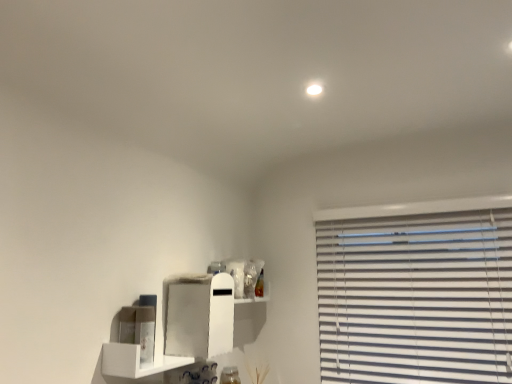
Image resolution: width=512 pixels, height=384 pixels. What do you see at coordinates (135, 361) in the screenshot? I see `white matte shelf at lower left` at bounding box center [135, 361].

Where is `white matte shelf at lower left`? white matte shelf at lower left is located at coordinates (135, 361).

The width and height of the screenshot is (512, 384). I want to click on white matte cabinet at center, so click(x=198, y=315).

What do you see at coordinates (198, 315) in the screenshot?
I see `white matte cabinet at center` at bounding box center [198, 315].

In order to face white matte cabinet at center, should I rotate leftwards or rightwards?

A 7.161 degree turn to the left will do.

At what (x,y) coordinates should I click in order to perform the action: click on white matte shelf at lower left. Please return your answer as a coordinate pair (x, y). The width and height of the screenshot is (512, 384). Looking at the image, I should click on (135, 361).

Based on their positions, is white matte cabinet at center located to the left or right of white matte shelf at lower left?

white matte cabinet at center is to the right of white matte shelf at lower left.

Between white matte cabinet at center and white matte shelf at lower left, which one is positioned in front?

white matte shelf at lower left is closer to the camera.

Considering the points (222, 334) and (133, 365), which point is behind, point (222, 334) or point (133, 365)?

The point (222, 334) is farther from the camera.

From the image's perspective, is white matte cabinet at center on white matte shelf at lower left?

Yes.

From a real-world perspective, is white matte cabinet at center beneath white matte shelf at lower left?

No, from a real-world perspective, white matte cabinet at center is not under white matte shelf at lower left.

Based on the photo, does white matte cabinet at center have a lesser width compared to white matte shelf at lower left?

No, white matte cabinet at center is not thinner than white matte shelf at lower left.

Consider the image. Does white matte cabinet at center have a lesser height compared to white matte shelf at lower left?

No, white matte cabinet at center is not shorter than white matte shelf at lower left.

Does white matte cabinet at center have a smaller size compared to white matte shelf at lower left?

No, white matte cabinet at center is not smaller than white matte shelf at lower left.

Can we say white matte cabinet at center lies outside white matte shelf at lower left?

That's correct, white matte cabinet at center is outside of white matte shelf at lower left.

Are white matte cabinet at center and white matte shelf at lower left beside each other?

white matte cabinet at center and white matte shelf at lower left are clearly separated.

Does white matte cabinet at center turn towards white matte shelf at lower left?

No, white matte cabinet at center does not turn towards white matte shelf at lower left.

What's the angular difference between white matte cabinet at center and white matte shelf at lower left's facing directions?

They differ by 90.3 degrees in their facing directions.

Locate an element on the screen. The width and height of the screenshot is (512, 384). shelf on the left of the white matte cabinet at center is located at coordinates (135, 361).

Which object is positioned more to the left, white matte shelf at lower left or white matte cabinet at center?

white matte shelf at lower left.

Is white matte shelf at lower left in front of white matte cabinet at center?

Yes, the depth of white matte shelf at lower left is less than that of white matte cabinet at center.

Is point (184, 365) more distant than point (186, 313)?

No.

From the image's perspective, is white matte shelf at lower left located above or below white matte cabinet at center?

From the image's perspective, white matte shelf at lower left appears below white matte cabinet at center.

From a real-world perspective, relative to white matte cabinet at center, is white matte shelf at lower left vertically above or below?

In terms of real-world spatial position, white matte shelf at lower left is below white matte cabinet at center.

Considering the sizes of white matte shelf at lower left and white matte cabinet at center in the image, is white matte shelf at lower left wider or thinner than white matte cabinet at center?

Considering their sizes, white matte shelf at lower left looks slimmer than white matte cabinet at center.

Considering the relative sizes of white matte shelf at lower left and white matte cabinet at center in the image provided, is white matte shelf at lower left shorter than white matte cabinet at center?

Correct, white matte shelf at lower left is not as tall as white matte cabinet at center.

Is white matte shelf at lower left bigger than white matte cabinet at center?

Incorrect, white matte shelf at lower left is not larger than white matte cabinet at center.

Can white matte cabinet at center be found inside white matte shelf at lower left?

No, white matte shelf at lower left does not contain white matte cabinet at center.

Does white matte shelf at lower left touch white matte cabinet at center?

A: No, white matte shelf at lower left is not making contact with white matte cabinet at center.

Is white matte shelf at lower left looking in the opposite direction of white matte cabinet at center?

white matte shelf at lower left is not turned away from white matte cabinet at center.

What's the angular difference between white matte shelf at lower left and white matte cabinet at center's facing directions?

The angular difference between white matte shelf at lower left and white matte cabinet at center is 90.3 degrees.

The height and width of the screenshot is (384, 512). I want to click on shelf below the white matte cabinet at center (from a real-world perspective), so tap(135, 361).

At what (x,y) coordinates should I click in order to perform the action: click on shelf that is below the white matte cabinet at center (from the image's perspective). Please return your answer as a coordinate pair (x, y). This screenshot has height=384, width=512. Looking at the image, I should click on (135, 361).

At what (x,y) coordinates should I click in order to perform the action: click on cabinet lying behind the white matte shelf at lower left. Please return your answer as a coordinate pair (x, y). Looking at the image, I should click on (198, 315).